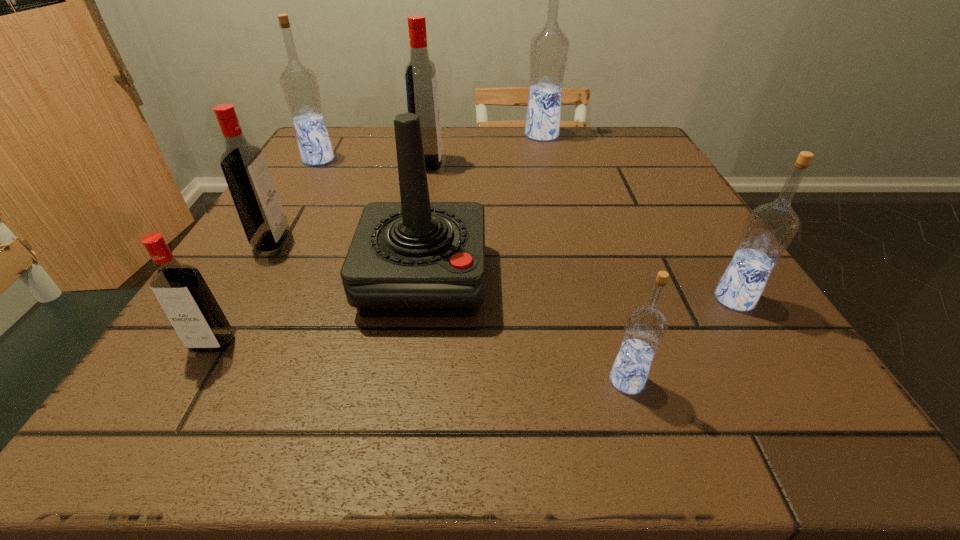
You are a GUI agent. You are given a task and a screenshot of the screen. Output one action in this format:
    pyautogui.click(x=<x>, y=<y>)
    Task: Click on the blank space located 0.210m on the left of the second nearest blue vodka
    
    Given the screenshot: What is the action you would take?
    pyautogui.click(x=578, y=299)

This screenshot has width=960, height=540. Identify the location of free region located on the front and back of the second nearest vodka. (166, 421).

Locate an element on the screen. The height and width of the screenshot is (540, 960). vacant space located 0.060m on the back of the nearest blue vodka is located at coordinates (612, 333).

This screenshot has height=540, width=960. Find the location of `object that is at the near edge`. object that is at the near edge is located at coordinates (645, 327).

You are a GUI agent. You are given a task and a screenshot of the screen. Output one action in this format:
    pyautogui.click(x=<x>, y=<y>)
    Task: Click on the object that is at the right edge
    This screenshot has width=960, height=540.
    Given the screenshot: What is the action you would take?
    pyautogui.click(x=769, y=229)

Image resolution: width=960 pixels, height=540 pixels. I want to click on object located in the far left corner section of the desktop, so click(299, 84).

Identify the location of blank space at the far edge of the desktop. The height and width of the screenshot is (540, 960). (552, 146).

This screenshot has width=960, height=540. I want to click on free space at the left edge of the desktop, so click(x=318, y=203).

Identify the location of vacant space at the right edge. This screenshot has height=540, width=960. (682, 219).

Identify the location of free space at the near left corner. (204, 399).